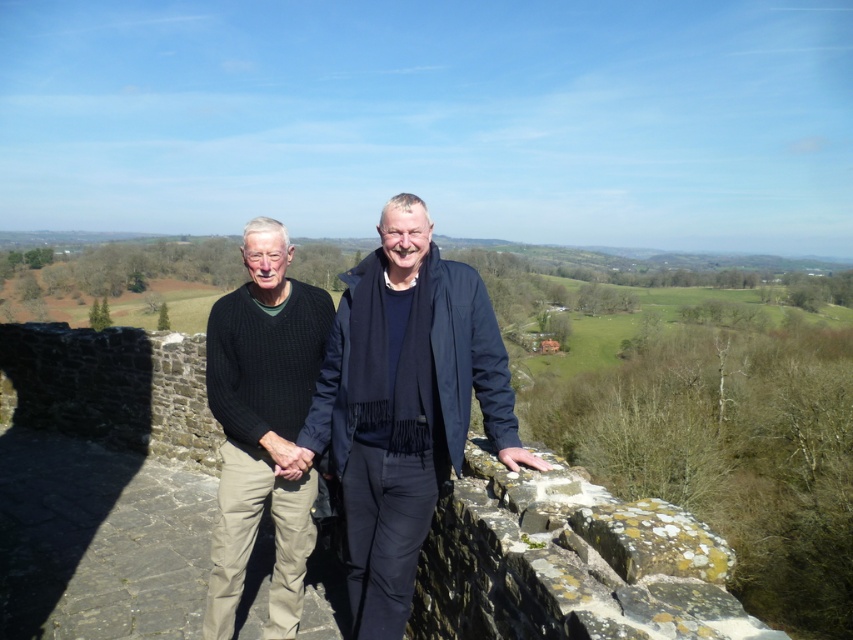
You are a photographer trying to capture both the knitted sweater at center and the black knitted sweater at left in a single frame. Based on their sizes, which sweater will appear smaller in the photo?

The knitted sweater at center will appear smaller in the photo because it has a lesser width compared to the black knitted sweater at left.

You are a photographer trying to capture the two people standing on the stone wall. You want to ensure that the knitted sweater at center and the black knitted sweater at left are both clearly visible in the photo. Based on their positions, which sweater should you focus on first to ensure it doesn t get cut off by the edge of the frame?

The knitted sweater at center is located below the black knitted sweater at left, so you should focus on the black knitted sweater at left first to ensure it stays within the frame.

In the scene shown: You are a photographer trying to capture a group photo of the two people on the stone wall. The knitted sweater at center is worn by the person on the left. If you want to ensure both subjects are in focus, what should you consider about their distance?

The two people are 10.50 feet apart, so to ensure both are in focus, the photographer should use a small aperture setting to increase depth of field, allowing both the knitted sweater at center and the other person to be sharp.